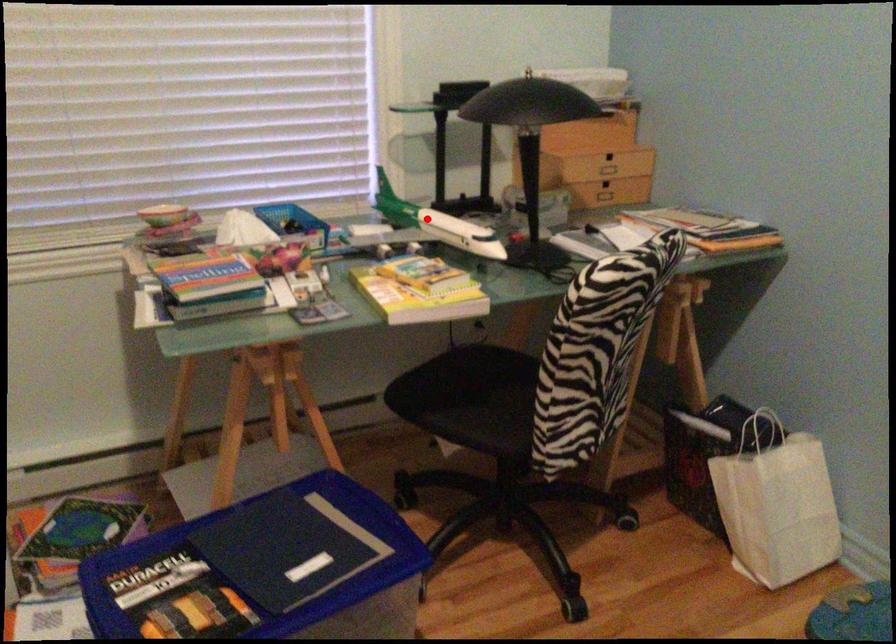
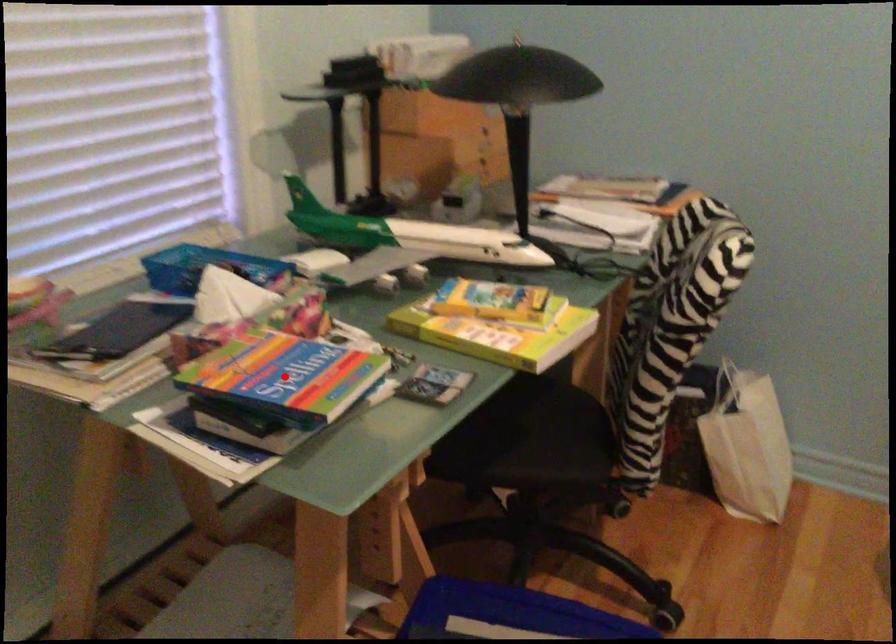
I am providing you with two images of the same scene from different viewpoints. A red point is marked on the first image and another point is marked on the second image. Is the marked point in image1 the same physical position as the marked point in image2?

No